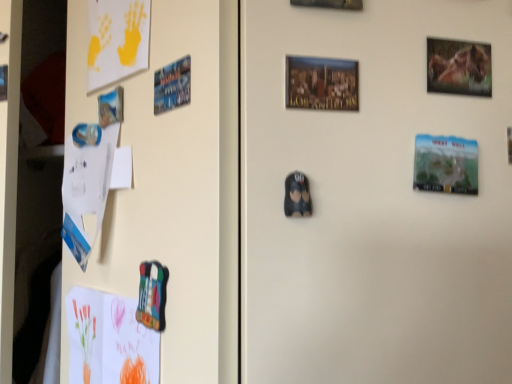
Question: In terms of size, does green matte great wall of china print at right, placed as the second print when sorted from back to front, appear bigger or smaller than metallic blue magnet at upper left, which ranks as the first print in back-to-front order?

Choices:
 (A) small
 (B) big

Answer: (B)

Question: Is point (432, 157) closer or farther from the camera than point (184, 97)?

Choices:
 (A) farther
 (B) closer

Answer: (B)

Question: Based on their relative distances, which object is nearer to the metallic blue magnet at upper left, the 3th print when ordered from front to back?

Choices:
 (A) yellow matte paper at upper left, acting as the 1th postcard starting from the top
 (B) metallic glossy horse portrait at upper right
 (C) colored paper postcard at lower left, which ranks as the first postcard in bottom-to-top order
 (D) black matte plush toy at center, the second print when ordered from right to left
 (E) green matte great wall of china print at right, which ranks as the second print in front-to-back order

Answer: (A)

Question: Which is nearer to the metallic glossy horse portrait at upper right?

Choices:
 (A) yellow matte paper at upper left, acting as the 1th postcard starting from the top
 (B) black matte plush toy at center, the 1th print from the front
 (C) colored paper postcard at lower left, placed as the 2th postcard when sorted from top to bottom
 (D) green matte great wall of china print at right, which ranks as the second print in front-to-back order
 (E) metallic blue magnet at upper left, placed as the 1th print when sorted from left to right

Answer: (D)